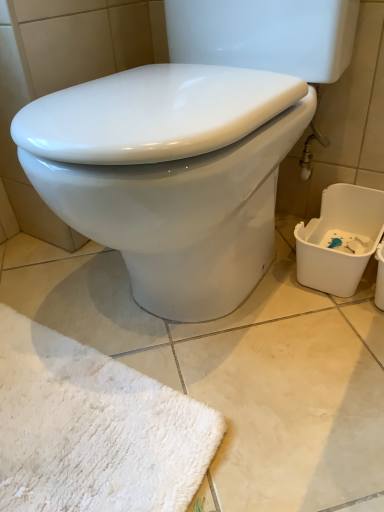
The height and width of the screenshot is (512, 384). Identify the location of white plastic container at lower right. (342, 239).

The width and height of the screenshot is (384, 512). What do you see at coordinates (342, 239) in the screenshot?
I see `white plastic container at lower right` at bounding box center [342, 239].

From the picture: Measure the distance between point (x=356, y=270) and camera.

The depth of point (x=356, y=270) is 32.72 inches.

The image size is (384, 512). I want to click on white plastic container at lower right, so click(x=342, y=239).